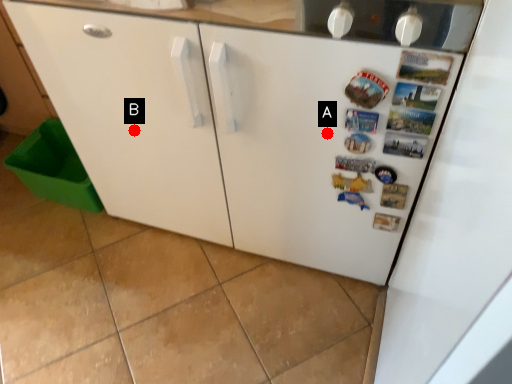
Question: Two points are circled on the image, labeled by A and B beside each circle. Among these points, which one is farthest from the camera?

Choices:
 (A) A is further
 (B) B is further

Answer: (B)